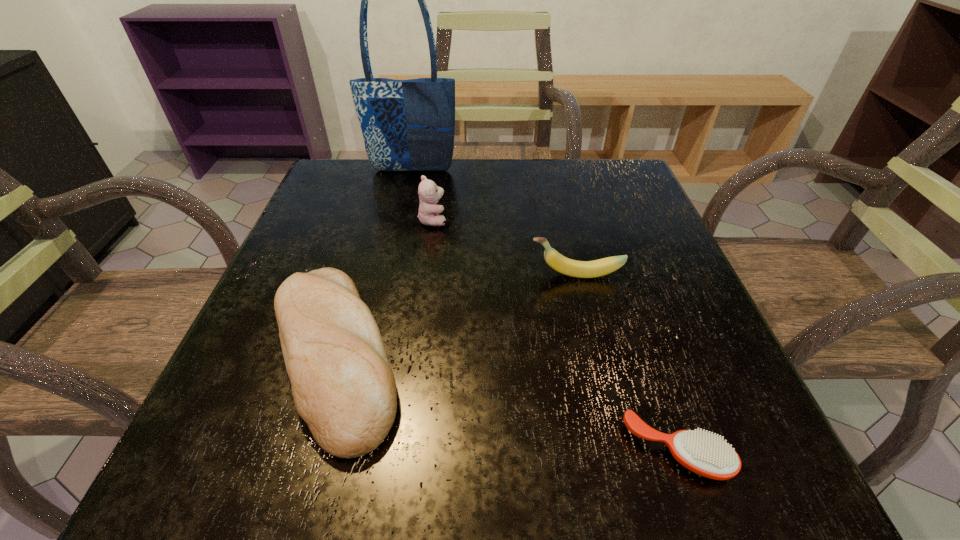
Identify the location of the tallest object. This screenshot has height=540, width=960. (408, 125).

Where is `the farthest object`? The image size is (960, 540). the farthest object is located at coordinates (408, 125).

Locate an element on the screen. teddy bear is located at coordinates (429, 193).

What are the coordinates of `banana` in the screenshot? It's located at (580, 269).

The image size is (960, 540). What are the coordinates of `bread` in the screenshot? It's located at (343, 386).

The height and width of the screenshot is (540, 960). Identify the location of the shortest object. (705, 454).

Identify the location of free space located 0.090m on the front-facing side of the tallest object. Image resolution: width=960 pixels, height=540 pixels. (x=407, y=196).

This screenshot has width=960, height=540. What are the coordinates of `free space located 0.270m at the face of the teddy bear` in the screenshot? It's located at (574, 220).

The image size is (960, 540). Find the location of `vacant region located 0.080m at the stem of the banana`. vacant region located 0.080m at the stem of the banana is located at coordinates (486, 275).

This screenshot has height=540, width=960. Identify the location of free space located 0.240m at the stem of the banana. (398, 275).